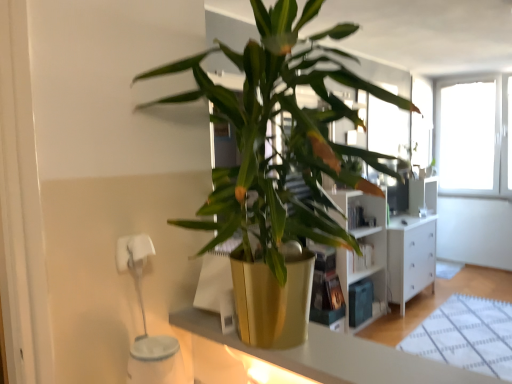
Question: From the image's perspective, is gold metallic pot at center located above or below metallic gold pot at center?

Choices:
 (A) below
 (B) above

Answer: (B)

Question: Considering the positions of point (200, 221) and point (451, 367), is point (200, 221) closer or farther from the camera than point (451, 367)?

Choices:
 (A) closer
 (B) farther

Answer: (B)

Question: Is gold metallic pot at center spatially inside metallic gold pot at center, or outside of it?

Choices:
 (A) outside
 (B) inside

Answer: (A)

Question: Is metallic gold pot at center in front of or behind gold metallic pot at center in the image?

Choices:
 (A) front
 (B) behind

Answer: (B)

Question: Would you say metallic gold pot at center is inside or outside gold metallic pot at center?

Choices:
 (A) inside
 (B) outside

Answer: (B)

Question: Visually, is metallic gold pot at center positioned to the left or to the right of gold metallic pot at center?

Choices:
 (A) left
 (B) right

Answer: (A)

Question: From the image's perspective, is metallic gold pot at center positioned above or below gold metallic pot at center?

Choices:
 (A) below
 (B) above

Answer: (A)